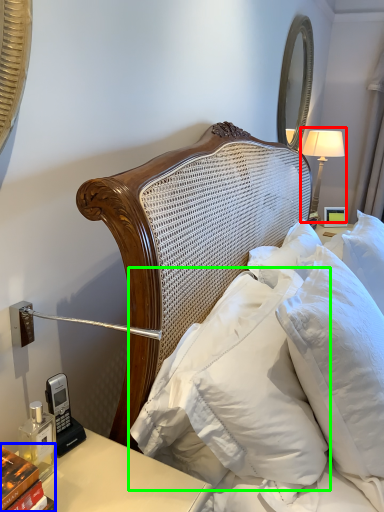
Question: Based on their relative distances, which object is nearer to bedside lamp (highlighted by a red box)? Choose from book (highlighted by a blue box) and pillow (highlighted by a green box).

Choices:
 (A) book
 (B) pillow

Answer: (B)